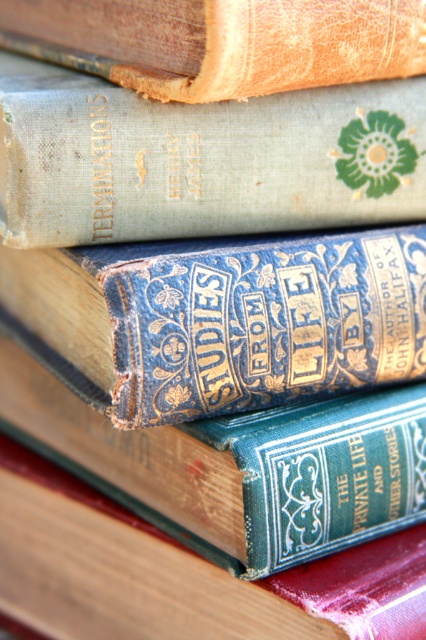
Is light green fabric book at upper center below green leather book at center?

No.

Which is more to the right, light green fabric book at upper center or green leather book at center?

From the viewer's perspective, light green fabric book at upper center appears more on the right side.

Between point (28, 138) and point (238, 584), which one is positioned behind?

The point (238, 584) is behind.

Image resolution: width=426 pixels, height=640 pixels. Find the location of `light green fabric book at upper center`. light green fabric book at upper center is located at coordinates (201, 160).

Does light green fabric book at upper center appear over blue leather book at center?

Correct, light green fabric book at upper center is located above blue leather book at center.

Is light green fabric book at upper center positioned at the back of blue leather book at center?

No, light green fabric book at upper center is in front of blue leather book at center.

Is point (213, 189) farther from viewer compared to point (178, 397)?

That is True.

Identify the location of light green fabric book at upper center. The image size is (426, 640). (201, 160).

Between point (227, 320) and point (299, 417), which one is positioned behind?

Point (299, 417)

This screenshot has width=426, height=640. I want to click on blue leather book at center, so click(256, 320).